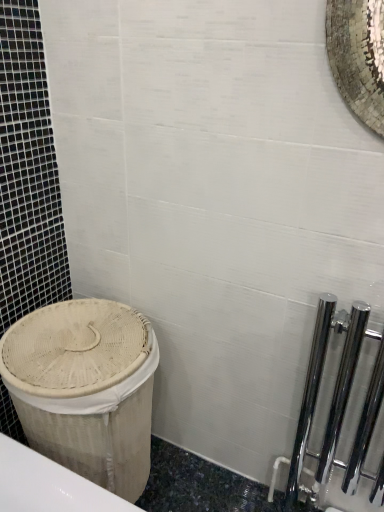
What do you see at coordinates (86, 389) in the screenshot?
I see `woven beige basket at left` at bounding box center [86, 389].

This screenshot has width=384, height=512. What are the coordinates of `woven beige basket at left` in the screenshot? It's located at pyautogui.click(x=86, y=389).

Identify the location of woven beige basket at left. (86, 389).